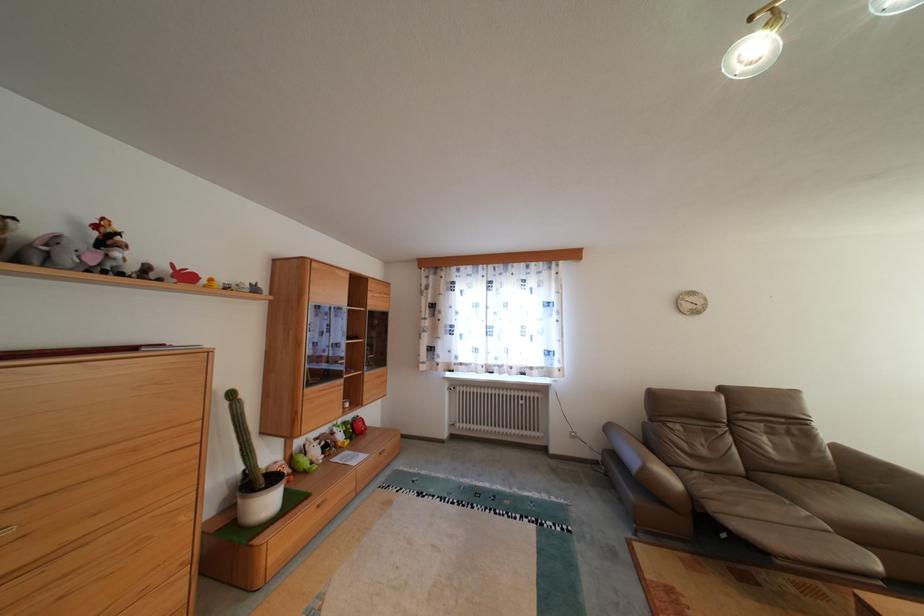
Find the location of `brown sofa sitting surface`. brown sofa sitting surface is located at coordinates (751, 503).